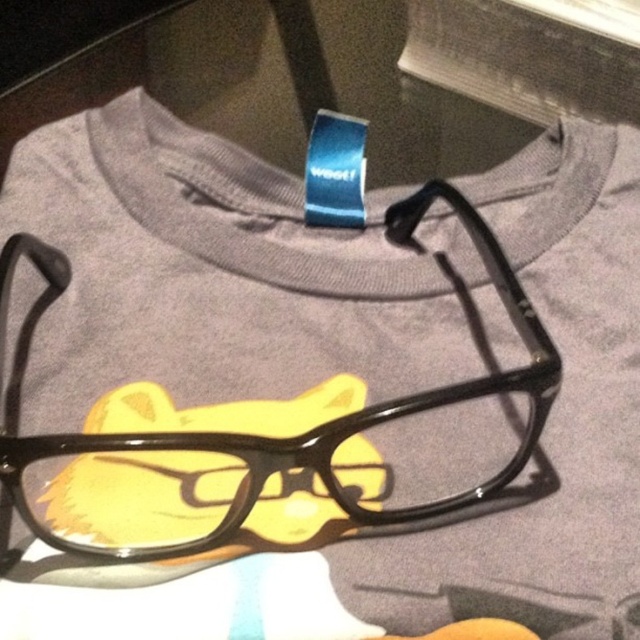
Measure the distance from black shiny glasses at center to yellow plush cat at center.

black shiny glasses at center is 2.23 inches from yellow plush cat at center.

Which of these two, black shiny glasses at center or yellow plush cat at center, stands shorter?

Standing shorter between the two is yellow plush cat at center.

Find the location of a particular element. Image resolution: width=640 pixels, height=640 pixels. black shiny glasses at center is located at coordinates (252, 435).

Identify the location of black shiny glasses at center. This screenshot has height=640, width=640. (252, 435).